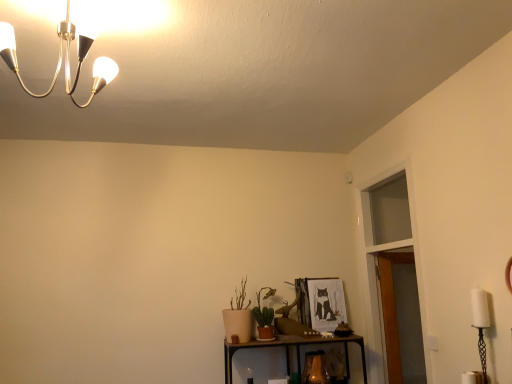
Question: Is transparent glass door at upper right taller or shorter than green matte cactus at center?

Choices:
 (A) tall
 (B) short

Answer: (A)

Question: Would you say transparent glass door at upper right is to the left or to the right of green matte cactus at center in the picture?

Choices:
 (A) right
 (B) left

Answer: (A)

Question: In terms of size, does transparent glass door at upper right appear bigger or smaller than green matte cactus at center?

Choices:
 (A) small
 (B) big

Answer: (B)

Question: In terms of size, does green matte cactus at center appear bigger or smaller than transparent glass door at upper right?

Choices:
 (A) small
 (B) big

Answer: (A)

Question: Which is correct: green matte cactus at center is inside transparent glass door at upper right, or outside of it?

Choices:
 (A) outside
 (B) inside

Answer: (A)

Question: In terms of height, does green matte cactus at center look taller or shorter compared to transparent glass door at upper right?

Choices:
 (A) short
 (B) tall

Answer: (A)

Question: Is point (256, 321) closer or farther from the camera than point (378, 329)?

Choices:
 (A) closer
 (B) farther

Answer: (A)